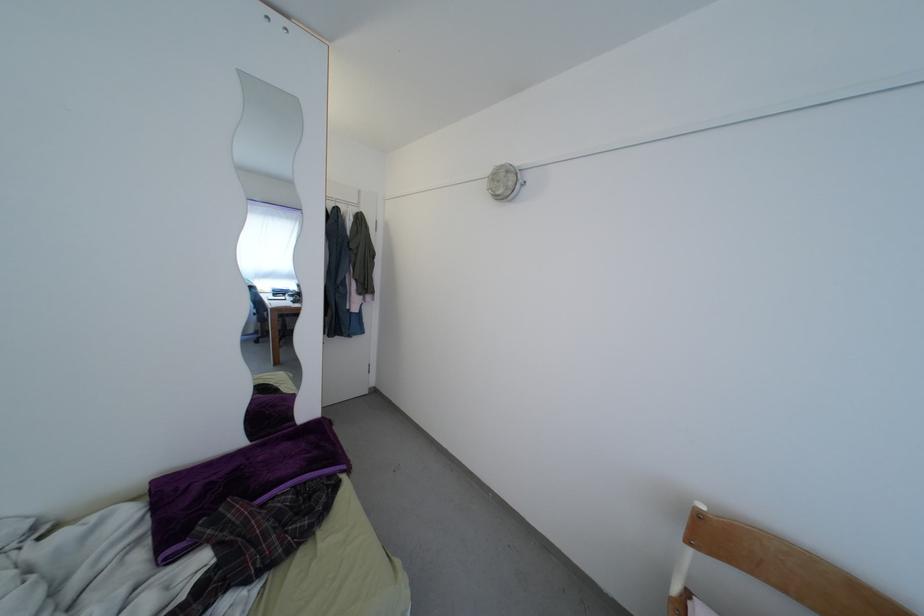
Where is `white coat hook`? This screenshot has height=616, width=924. white coat hook is located at coordinates (773, 569).